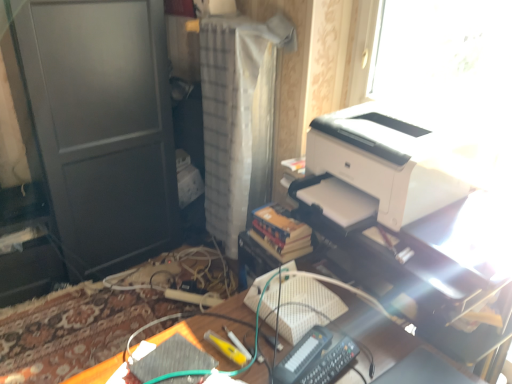
At what (x,y) coordinates should I click in order to perform the action: click on free space that is to the left of black plastic remote control at center. Please return your answer as a coordinate pair (x, y). The width and height of the screenshot is (512, 384). Looking at the image, I should click on (244, 346).